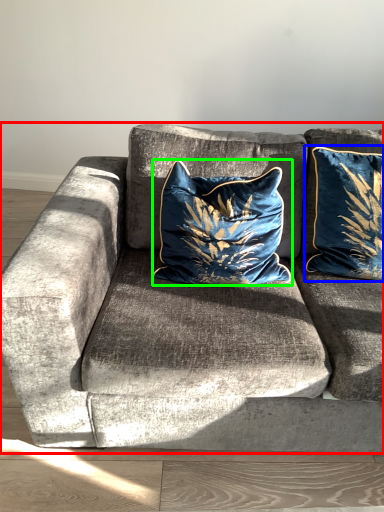
Question: Estimate the real-world distances between objects in this image. Which object is farther from studio couch (highlighted by a red box), pillow (highlighted by a blue box) or pillow (highlighted by a green box)?

Choices:
 (A) pillow
 (B) pillow

Answer: (A)